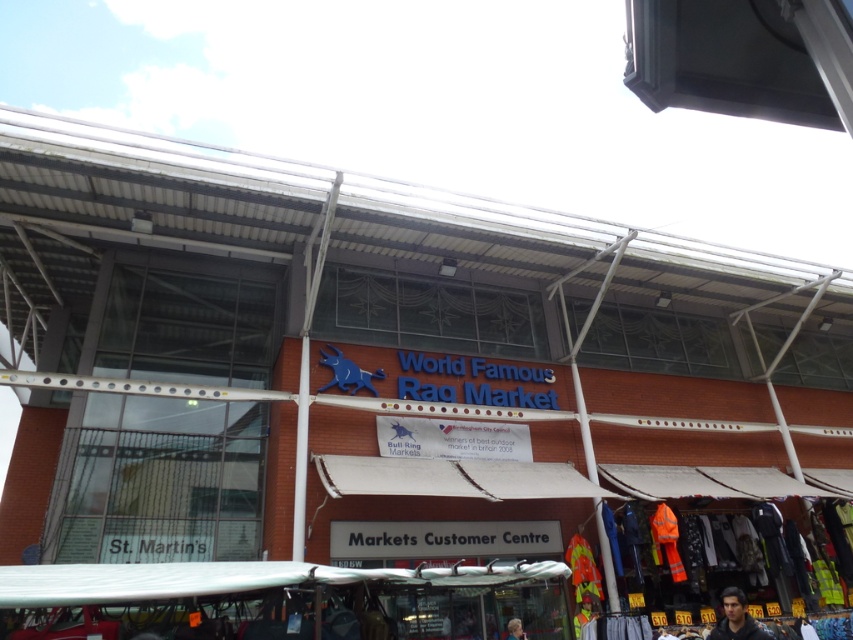
You are standing in front of the World Famous Rag Market building and want to take a photo. There are two points on the building marked as point 1 at coordinates (755, 637) and point 2 at (515, 621). Which point will appear larger in your photo?

Point 1 at coordinates (755, 637) will appear larger in the photo because it is closer to the camera than point 2 at (515, 621).

You are a photographer standing in front of the World Famous Rag Market building. You notice a dark blue jacket at lower right and a smooth skin face at lower center. Which object is positioned higher in the image?

The dark blue jacket at lower right is located above the smooth skin face at lower center, so the dark blue jacket at lower right is positioned higher in the image.

You are a photographer standing in front of the World Famous Rag Market building. You notice a dark blue jacket at lower right and a smooth skin face at lower center. Which object is positioned to the right of the other?

The dark blue jacket at lower right is to the right of the smooth skin face at lower center.